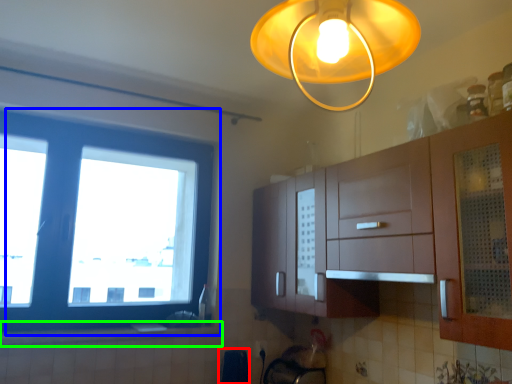
Question: Which object is the farthest from appliance (highlighted by a red box)? Choose among these: window (highlighted by a blue box) or counter top (highlighted by a green box).

Choices:
 (A) window
 (B) counter top

Answer: (A)